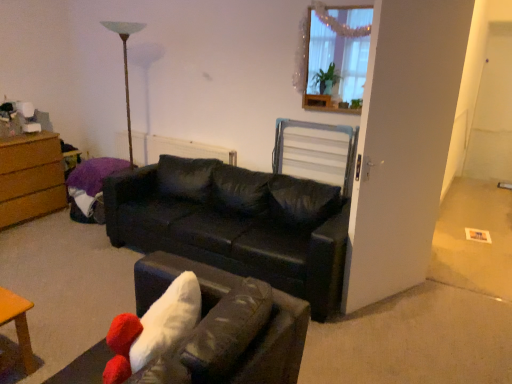
Question: Is wooden frame at upper right further to the viewer compared to metallic silver swivel chair at center?

Choices:
 (A) yes
 (B) no

Answer: (B)

Question: Is wooden frame at upper right next to metallic silver swivel chair at center?

Choices:
 (A) no
 (B) yes

Answer: (A)

Question: Is wooden frame at upper right positioned far away from metallic silver swivel chair at center?

Choices:
 (A) no
 (B) yes

Answer: (A)

Question: Does wooden frame at upper right have a lesser width compared to metallic silver swivel chair at center?

Choices:
 (A) no
 (B) yes

Answer: (B)

Question: Does wooden frame at upper right have a lesser height compared to metallic silver swivel chair at center?

Choices:
 (A) yes
 (B) no

Answer: (B)

Question: In terms of width, does black leather couch at center, acting as the 2th studio couch starting from the back, look wider or thinner when compared to wooden frame at upper right?

Choices:
 (A) thin
 (B) wide

Answer: (B)

Question: Is black leather couch at center, acting as the 2th studio couch starting from the back, situated inside wooden frame at upper right or outside?

Choices:
 (A) inside
 (B) outside

Answer: (B)

Question: From their relative heights in the image, would you say black leather couch at center, acting as the 2th studio couch starting from the back, is taller or shorter than wooden frame at upper right?

Choices:
 (A) tall
 (B) short

Answer: (A)

Question: Considering their positions, is black leather couch at center, acting as the 2th studio couch starting from the back, located in front of or behind wooden frame at upper right?

Choices:
 (A) front
 (B) behind

Answer: (A)

Question: Does point (348, 87) appear closer or farther from the camera than point (145, 221)?

Choices:
 (A) farther
 (B) closer

Answer: (B)

Question: In terms of width, does wooden frame at upper right look wider or thinner when compared to black leather couch at center, the first studio couch viewed from the back?

Choices:
 (A) thin
 (B) wide

Answer: (A)

Question: From the image's perspective, is wooden frame at upper right located above or below black leather couch at center, the 2th studio couch in the front-to-back sequence?

Choices:
 (A) below
 (B) above

Answer: (B)

Question: Considering their positions, is wooden frame at upper right located in front of or behind black leather couch at center, the 2th studio couch in the front-to-back sequence?

Choices:
 (A) behind
 (B) front

Answer: (A)

Question: In terms of height, does black leather couch at center, the first studio couch viewed from the back, look taller or shorter compared to metallic silver swivel chair at center?

Choices:
 (A) tall
 (B) short

Answer: (A)

Question: Choose the correct answer: Is black leather couch at center, the 2th studio couch in the front-to-back sequence, inside metallic silver swivel chair at center or outside it?

Choices:
 (A) outside
 (B) inside

Answer: (A)